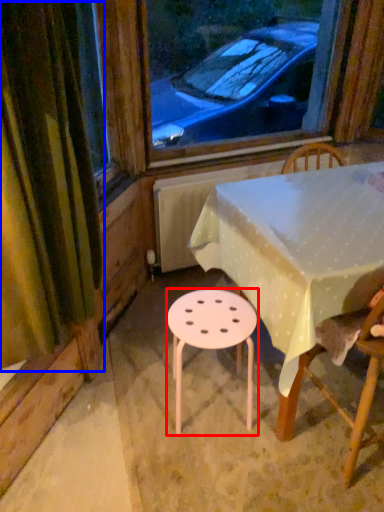
Question: Which point is closer to the camera, stool (highlighted by a red box) or curtain (highlighted by a blue box)?

Choices:
 (A) stool
 (B) curtain

Answer: (B)